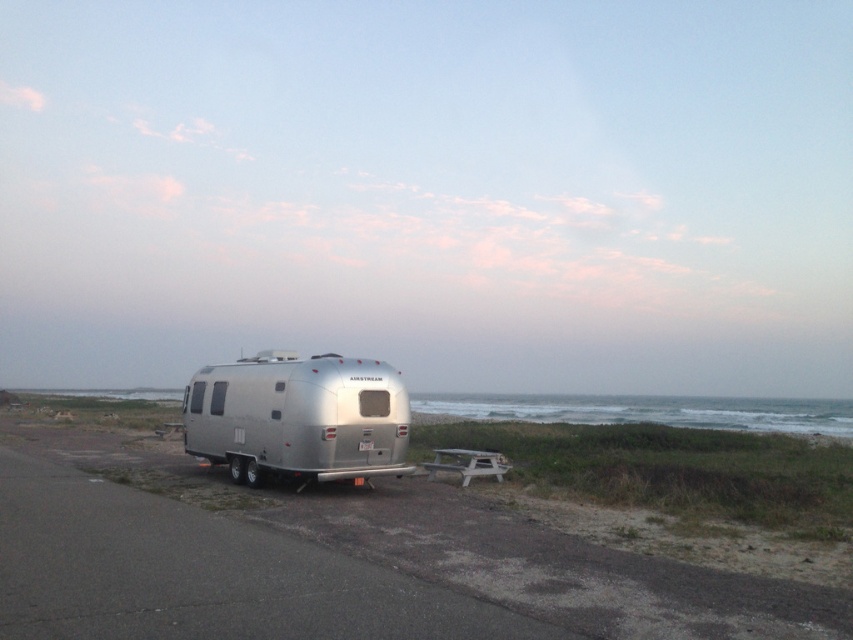
Question: Observing the image, what is the correct spatial positioning of silver metallic trailer at center in reference to silver metallic airstream trailer at center?

Choices:
 (A) left
 (B) right

Answer: (B)

Question: Is silver metallic trailer at center wider than silver metallic airstream trailer at center?

Choices:
 (A) no
 (B) yes

Answer: (B)

Question: Where is silver metallic trailer at center located in relation to silver metallic airstream trailer at center in the image?

Choices:
 (A) above
 (B) below

Answer: (B)